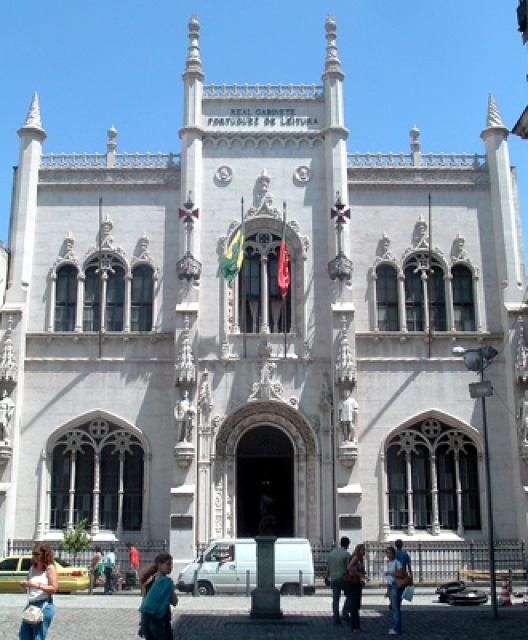
Question: Which point is closer to the camera?

Choices:
 (A) denim jeans at lower center
 (B) denim jeans at lower left
 (C) green fabric dress at center

Answer: (B)

Question: Is teal fabric jacket at lower center behind denim jeans at lower center?

Choices:
 (A) yes
 (B) no

Answer: (B)

Question: Does denim jeans at lower left come in front of dark brown leather jacket at center?

Choices:
 (A) no
 (B) yes

Answer: (B)

Question: Is dark brown leather jacket at center below green fabric bag at lower center?

Choices:
 (A) no
 (B) yes

Answer: (A)

Question: Which object is farther from the camera taking this photo?

Choices:
 (A) denim jeans at lower center
 (B) dark green fabric jacket at lower center

Answer: (B)

Question: Which point appears farthest from the camera in this image?

Choices:
 (A) (386, 566)
 (B) (106, 564)

Answer: (B)